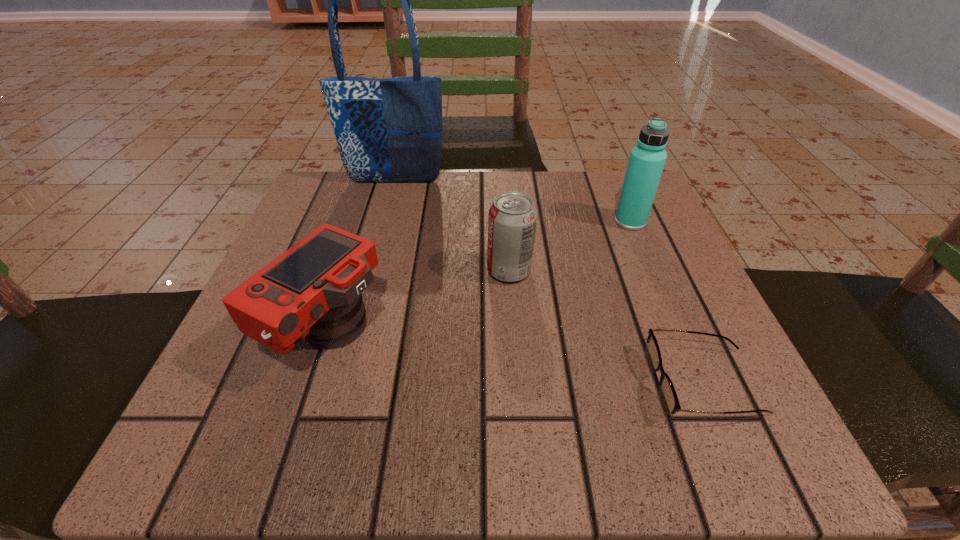
Identify the location of vacant region at the near right corner of the desktop. (784, 449).

This screenshot has width=960, height=540. Find the location of `free space between the fourth nearest object and the soda can`. free space between the fourth nearest object and the soda can is located at coordinates (570, 246).

Where is `free spot between the third nearest object and the spectacles`? Image resolution: width=960 pixels, height=540 pixels. free spot between the third nearest object and the spectacles is located at coordinates (606, 327).

Where is `vacant space in between the shortest object and the second tallest object`? Image resolution: width=960 pixels, height=540 pixels. vacant space in between the shortest object and the second tallest object is located at coordinates (667, 302).

I want to click on free space that is in between the third farthest object and the spectacles, so click(x=606, y=327).

You are a GUI agent. You are given a task and a screenshot of the screen. Output one action in this format:
    pyautogui.click(x=<x>, y=<y>)
    Task: Click on the vacant area that lies between the thermos bottle and the spectacles
    
    Given the screenshot: What is the action you would take?
    pyautogui.click(x=667, y=302)

Where is `vacant area between the spectacles and the fourth nearest object`? vacant area between the spectacles and the fourth nearest object is located at coordinates (667, 302).

Locate an element on the screen. The height and width of the screenshot is (540, 960). the third closest object to the tallest object is located at coordinates (647, 159).

Identify which object is the closest to the camera. Please provide its 2D coordinates. Your answer should be formatted as a tuple, i.e. [(x, y)], where the tuple contains the x and y coordinates of a point satisfying the conditions above.

[(512, 219)]

Find the location of `blank space that satisfies the following two spatial constraints: 1. on the front-facing side of the soda can; 2. on the right side of the shopping bag`. blank space that satisfies the following two spatial constraints: 1. on the front-facing side of the soda can; 2. on the right side of the shopping bag is located at coordinates (372, 271).